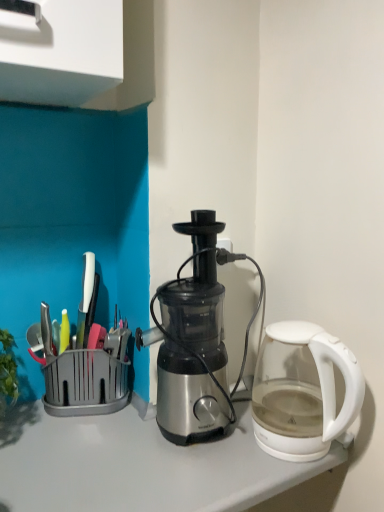
Question: In the image, is metallic silver juicer at center on the left side or the right side of transparent glass kettle at right?

Choices:
 (A) right
 (B) left

Answer: (B)

Question: Would you say metallic silver juicer at center is inside or outside transparent glass kettle at right?

Choices:
 (A) outside
 (B) inside

Answer: (A)

Question: Looking at the image, does metallic silver juicer at center seem bigger or smaller compared to transparent glass kettle at right?

Choices:
 (A) small
 (B) big

Answer: (B)

Question: Does point (281, 326) appear closer or farther from the camera than point (218, 287)?

Choices:
 (A) closer
 (B) farther

Answer: (A)

Question: Considering their positions, is transparent glass kettle at right located in front of or behind metallic silver juicer at center?

Choices:
 (A) behind
 (B) front

Answer: (B)

Question: Considering the positions of transparent glass kettle at right and metallic silver juicer at center in the image, is transparent glass kettle at right wider or thinner than metallic silver juicer at center?

Choices:
 (A) wide
 (B) thin

Answer: (A)

Question: Considering the positions of transparent glass kettle at right and metallic silver juicer at center in the image, is transparent glass kettle at right bigger or smaller than metallic silver juicer at center?

Choices:
 (A) big
 (B) small

Answer: (B)